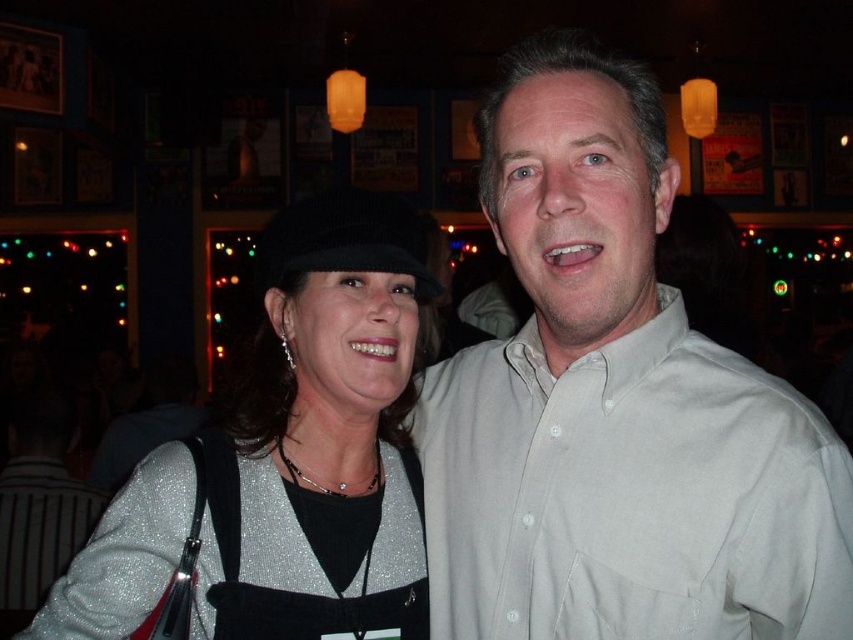
Question: Which point is closer to the camera taking this photo?

Choices:
 (A) (312, 326)
 (B) (323, 592)
 (C) (791, 628)

Answer: (C)

Question: Is glittery fabric apron at center to the left of satin silver necklace at center from the viewer's perspective?

Choices:
 (A) yes
 (B) no

Answer: (A)

Question: Can you confirm if sparkly silver sweater at left is smaller than smooth beige shirt at center?

Choices:
 (A) no
 (B) yes

Answer: (A)

Question: Which object is positioned farthest from the light gray cotton shirt at center?

Choices:
 (A) smooth beige shirt at center
 (B) glittery fabric apron at center
 (C) sparkly silver sweater at left
 (D) satin silver necklace at center

Answer: (D)

Question: Does sparkly silver sweater at left have a larger size compared to satin silver necklace at center?

Choices:
 (A) yes
 (B) no

Answer: (A)

Question: Based on their relative distances, which object is farther from the satin silver necklace at center?

Choices:
 (A) smooth beige shirt at center
 (B) glittery fabric apron at center
 (C) sparkly silver sweater at left
 (D) light gray cotton shirt at center

Answer: (D)